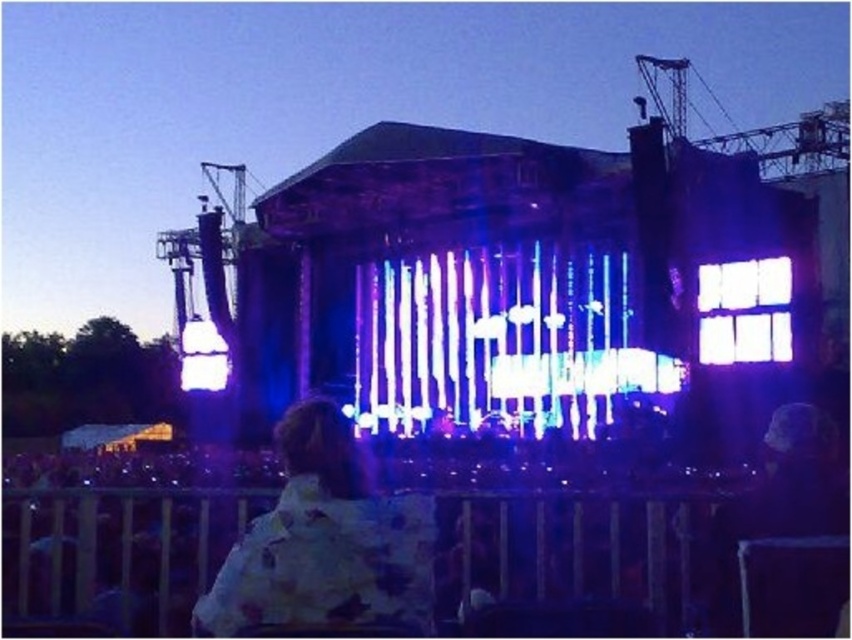
In the scene shown: Is neon glass tubes at center bigger than floral-patterned jacket at center?

Yes, neon glass tubes at center is bigger than floral-patterned jacket at center.

Who is higher up, neon glass tubes at center or floral-patterned jacket at center?

neon glass tubes at center is higher up.

Does point (599, 396) lie in front of point (222, 604)?

No.

Image resolution: width=852 pixels, height=640 pixels. What are the coordinates of `neon glass tubes at center` in the screenshot? It's located at (499, 340).